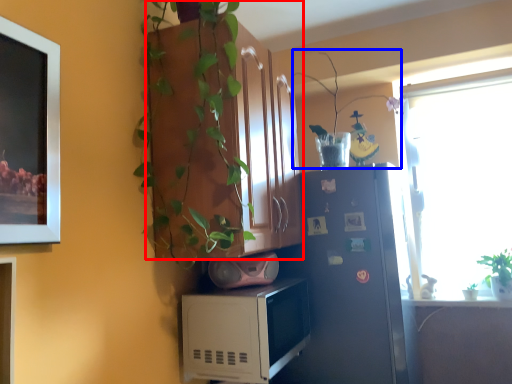
Question: Which point is further to the camera, cabinetry (highlighted by a red box) or plant (highlighted by a blue box)?

Choices:
 (A) cabinetry
 (B) plant

Answer: (B)